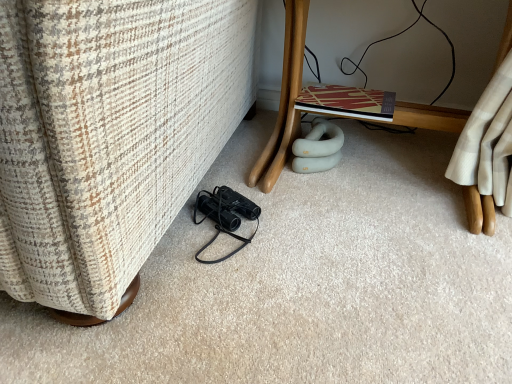
This screenshot has height=384, width=512. Find the location of `vacant space underneath wooden table at lower center (from a real-world perspective)`. vacant space underneath wooden table at lower center (from a real-world perspective) is located at coordinates (394, 182).